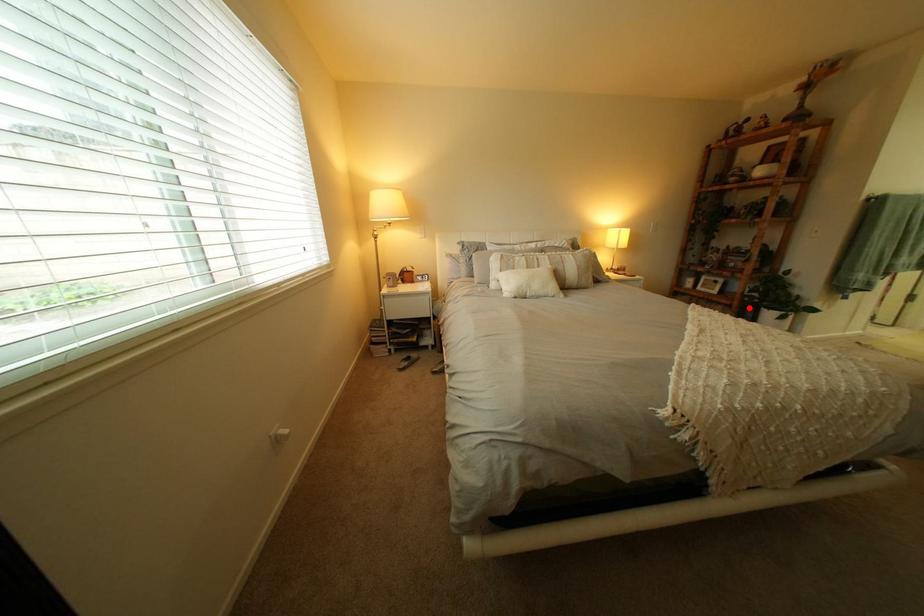
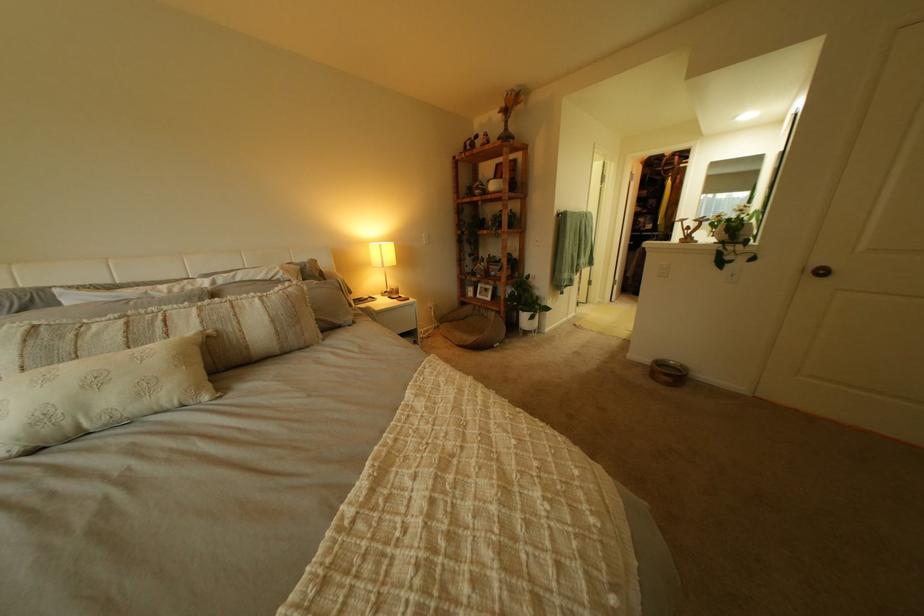
The point at the highlighted location is marked in the first image. Where is the corresponding point in the second image?

(517, 314)